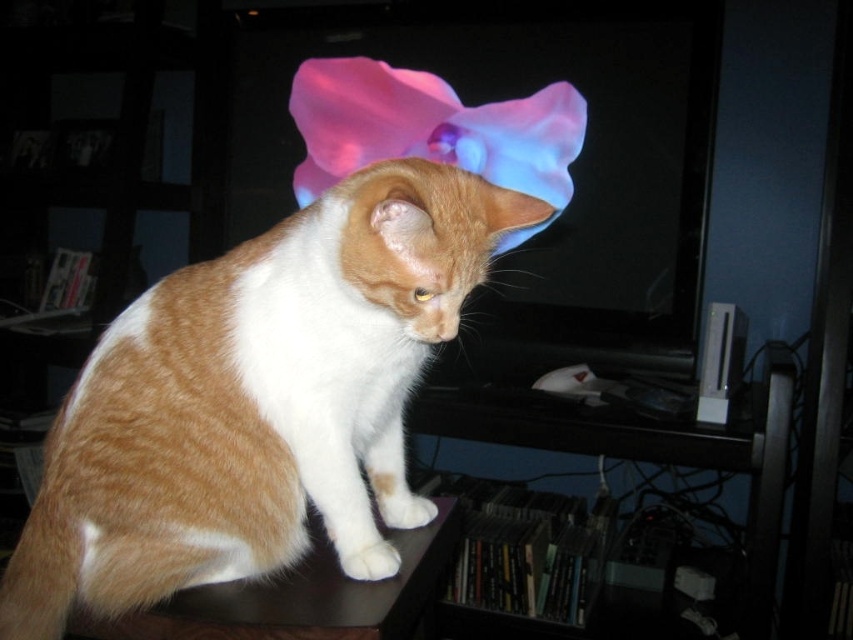
Question: Can you confirm if orange fur cat at center is positioned to the left of brown wooden table at lower left?

Choices:
 (A) no
 (B) yes

Answer: (A)

Question: In this image, where is orange fur cat at center located relative to brown wooden table at lower left?

Choices:
 (A) right
 (B) left

Answer: (A)

Question: Which point is farther to the camera?

Choices:
 (A) orange fur cat at center
 (B) brown wooden table at lower left
 (C) orange-white fur cat at center

Answer: (B)

Question: Is orange fur cat at center closer to camera compared to brown wooden table at lower left?

Choices:
 (A) yes
 (B) no

Answer: (A)

Question: Which point appears closest to the camera in this image?

Choices:
 (A) (343, 600)
 (B) (415, 160)
 (C) (117, 477)

Answer: (A)

Question: Which point is closer to the camera?

Choices:
 (A) (148, 614)
 (B) (245, 448)
 (C) (440, 172)

Answer: (A)